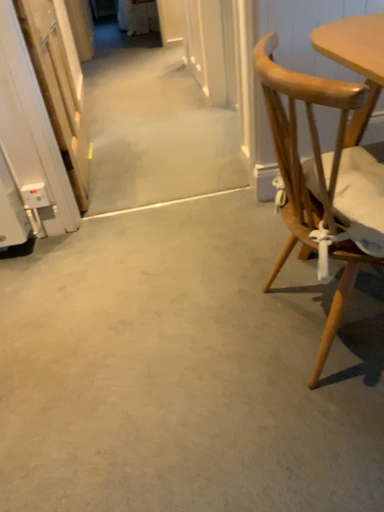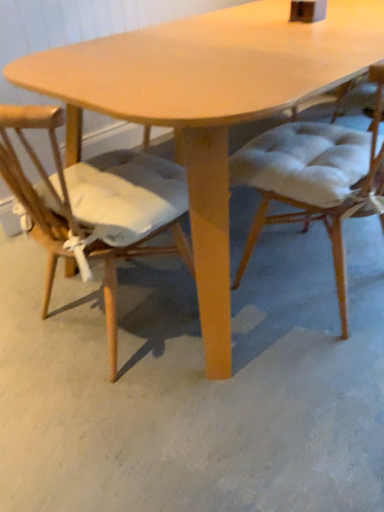
Question: Which way did the camera rotate in the video?

Choices:
 (A) rotated left
 (B) rotated right

Answer: (B)